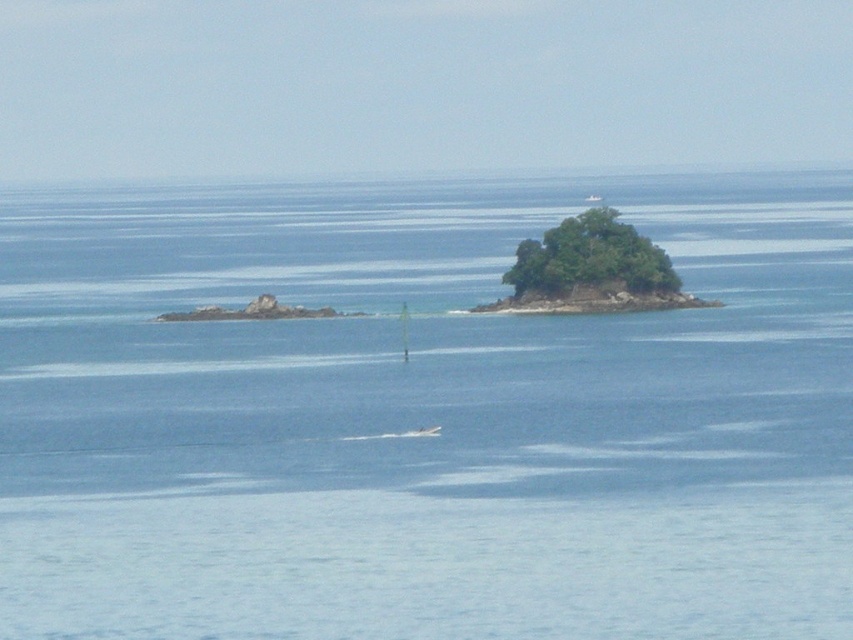
You are a bird soaring above the serene seascape. You spot the blue water at center and the green leafy island at center. Which one is positioned higher from the ground level?

The blue water at center is above the green leafy island at center, so the blue water at center is higher from the ground level.

You are a drone operator trying to capture aerial shots of the two islands. You have two designated points marked as point 1 at point [802,499] and point 2 at point [589,237]. From your current position, which point is closer to you?

Point 1 at point [802,499] is closer to you because it is in front of point 2 at point [589,237].

You are standing on the green mossy rock at left and want to reach the white plastic boat at center. Which direction should you move to get there?

You should move to the right to reach the white plastic boat at center since the green mossy rock at left is positioned on the left side of it.